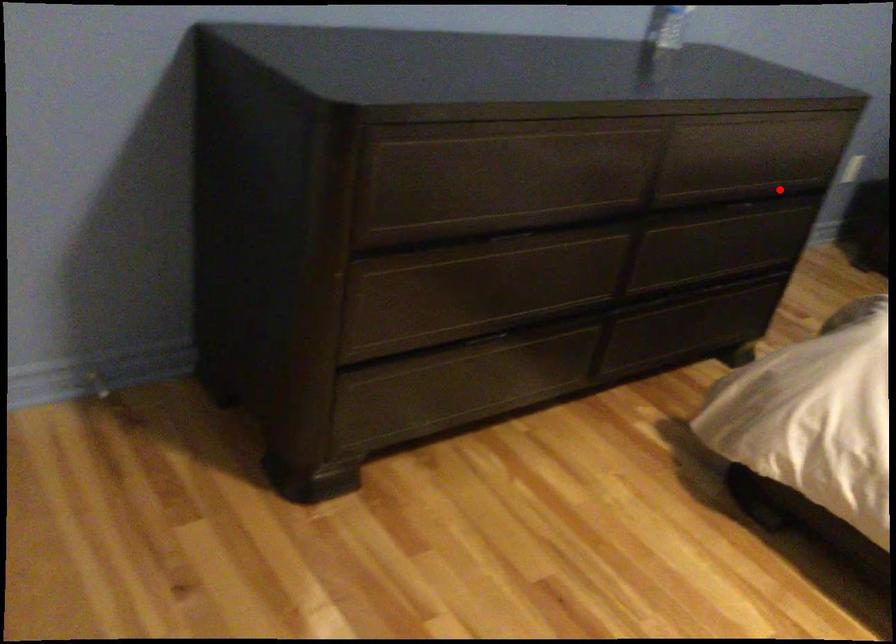
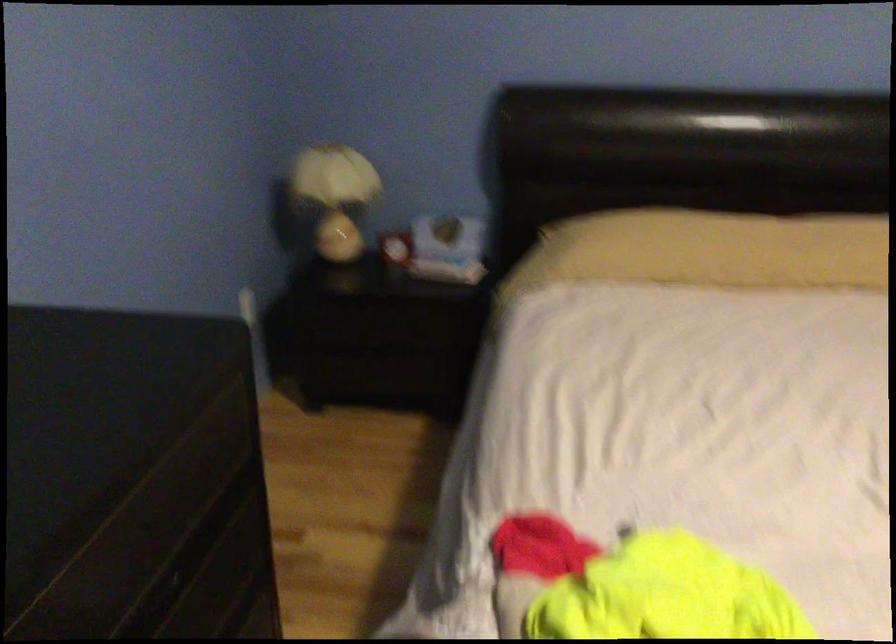
Question: I am providing you with two images of the same scene from different viewpoints. Given a red point in image1, look at the same physical point in image2. Is it:

Choices:
 (A) Closer to the viewpoint
 (B) Farther from the viewpoint

Answer: (A)